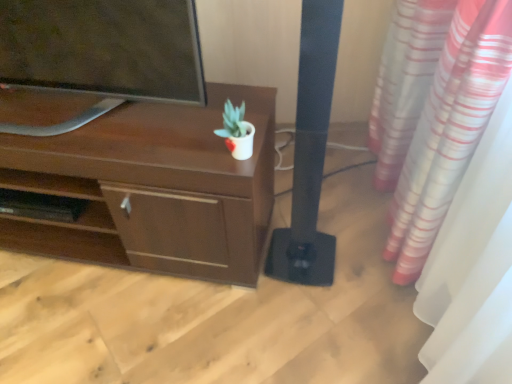
Question: Is black matte speaker at center thinner than brown matte desk at upper left?

Choices:
 (A) yes
 (B) no

Answer: (A)

Question: Does black matte speaker at center appear on the right side of brown matte desk at upper left?

Choices:
 (A) yes
 (B) no

Answer: (A)

Question: From the image's perspective, would you say black matte speaker at center is shown under brown matte desk at upper left?

Choices:
 (A) no
 (B) yes

Answer: (A)

Question: From a real-world perspective, is black matte speaker at center beneath brown matte desk at upper left?

Choices:
 (A) yes
 (B) no

Answer: (B)

Question: Can you confirm if black matte speaker at center is taller than brown matte desk at upper left?

Choices:
 (A) no
 (B) yes

Answer: (B)

Question: Does point (161, 264) appear closer or farther from the camera than point (135, 34)?

Choices:
 (A) farther
 (B) closer

Answer: (A)

Question: From the image's perspective, is brown matte desk at upper left above or below matte black tv at upper left?

Choices:
 (A) above
 (B) below

Answer: (B)

Question: In terms of size, does brown matte desk at upper left appear bigger or smaller than matte black tv at upper left?

Choices:
 (A) big
 (B) small

Answer: (A)

Question: Do you think brown matte desk at upper left is within matte black tv at upper left, or outside of it?

Choices:
 (A) outside
 (B) inside

Answer: (A)

Question: Considering the positions of point (245, 142) and point (181, 31), is point (245, 142) closer or farther from the camera than point (181, 31)?

Choices:
 (A) farther
 (B) closer

Answer: (A)

Question: Would you say white glossy pot at center is inside or outside matte black tv at upper left?

Choices:
 (A) outside
 (B) inside

Answer: (A)

Question: Considering the positions of white glossy pot at center and matte black tv at upper left in the image, is white glossy pot at center taller or shorter than matte black tv at upper left?

Choices:
 (A) short
 (B) tall

Answer: (A)

Question: Is white glossy pot at center in front of or behind matte black tv at upper left in the image?

Choices:
 (A) front
 (B) behind

Answer: (B)

Question: Visually, is black matte speaker at center positioned to the left or to the right of brown matte desk at upper left?

Choices:
 (A) right
 (B) left

Answer: (A)

Question: In terms of size, does black matte speaker at center appear bigger or smaller than brown matte desk at upper left?

Choices:
 (A) small
 (B) big

Answer: (A)